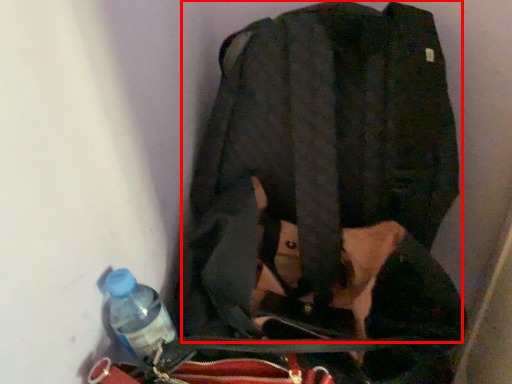
Question: From the image, what is the correct spatial relationship of jacket (annotated by the red box) in relation to bottle?

Choices:
 (A) left
 (B) right

Answer: (B)